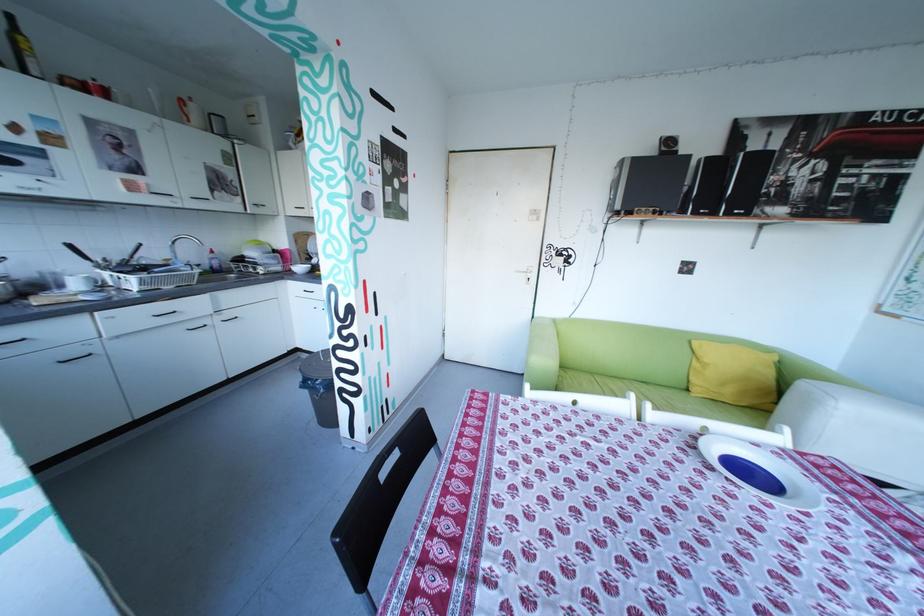
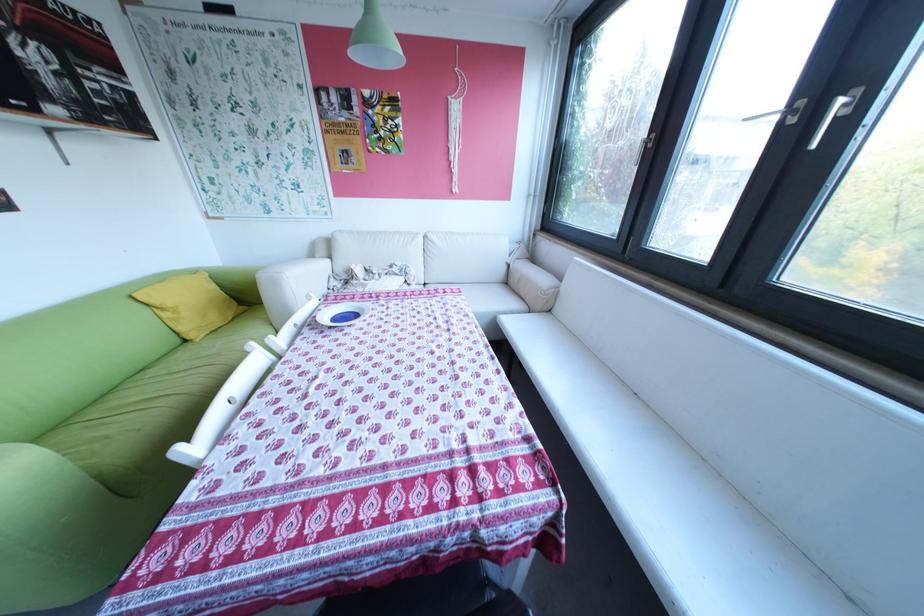
Locate, in the second image, the point that corresponds to the point at 708,363 in the first image.

(177, 314)